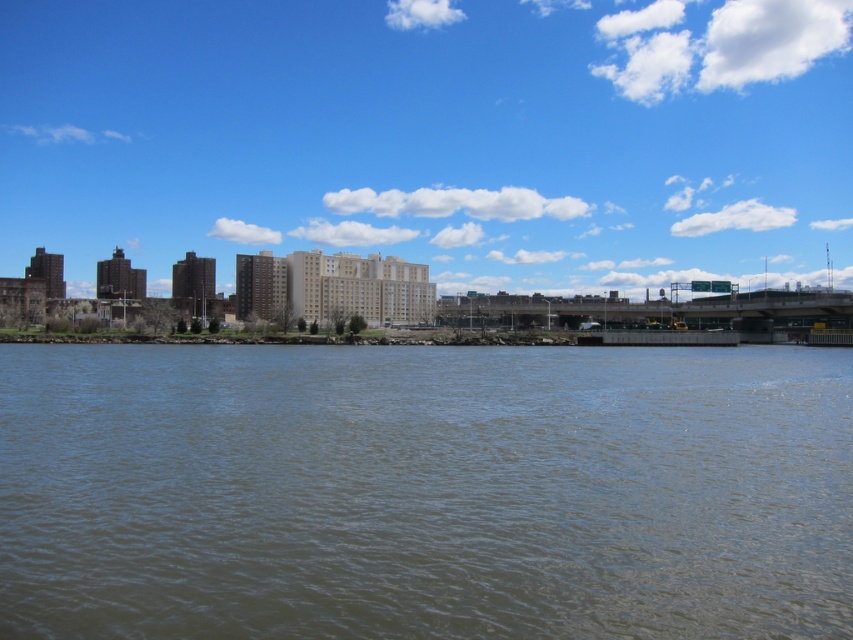
Question: Can you confirm if brown water at lower center is positioned above matte concrete buildings at center?

Choices:
 (A) no
 (B) yes

Answer: (A)

Question: Is brown water at lower center thinner than matte concrete buildings at center?

Choices:
 (A) yes
 (B) no

Answer: (A)

Question: Is brown water at lower center wider than matte concrete buildings at center?

Choices:
 (A) yes
 (B) no

Answer: (B)